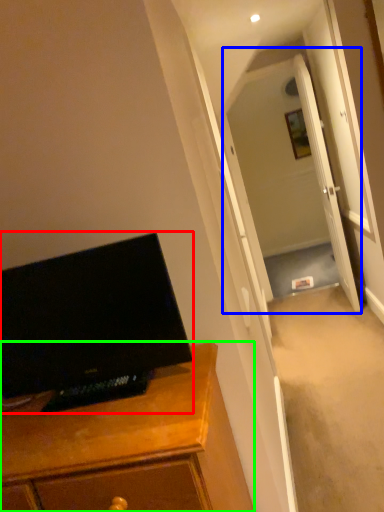
Question: Which object is positioned farthest from computer monitor (highlighted by a red box)? Select from glass door (highlighted by a blue box) and cabinetry (highlighted by a green box).

Choices:
 (A) glass door
 (B) cabinetry

Answer: (A)